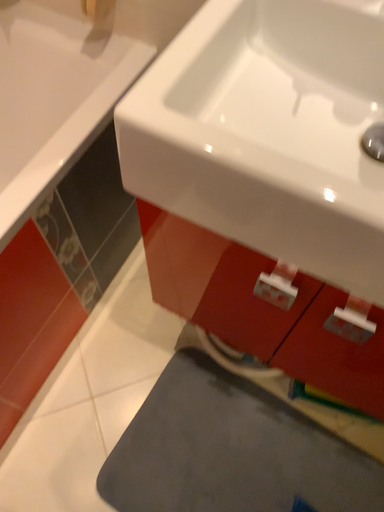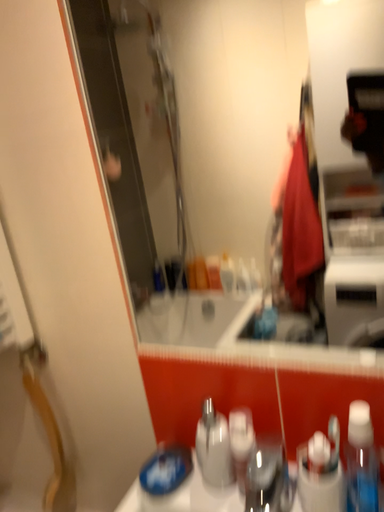
Question: How did the camera likely rotate when shooting the video?

Choices:
 (A) rotated downward
 (B) rotated upward

Answer: (B)